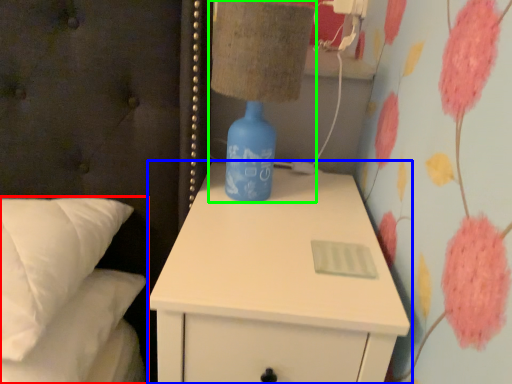
Question: Which is nearer to the bed (highlighted by a red box)? nightstand (highlighted by a blue box) or table lamp (highlighted by a green box).

Choices:
 (A) nightstand
 (B) table lamp

Answer: (A)